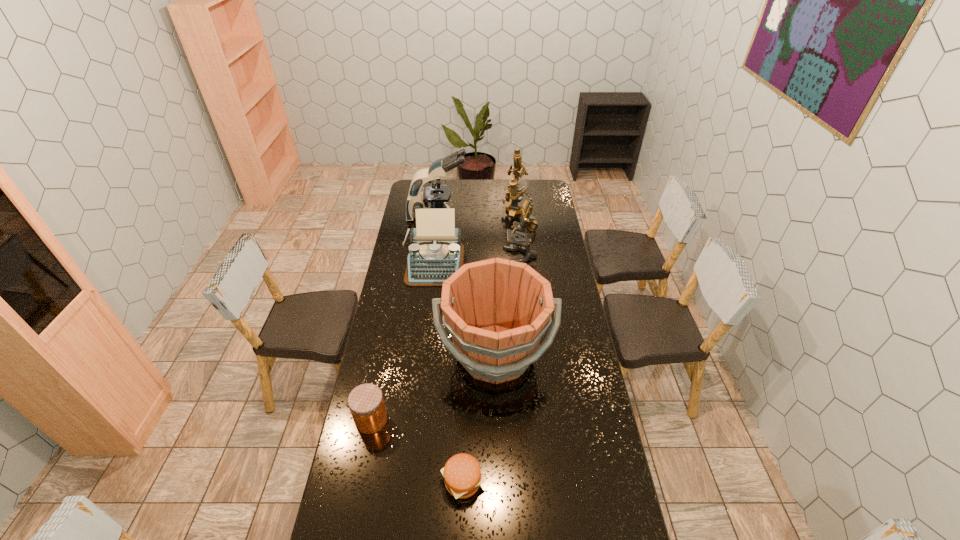
You are a GUI agent. You are given a task and a screenshot of the screen. Output one action in this format:
    pyautogui.click(x=<x>, y=<y>)
    Task: Click on the vacant area situated at the eyepieces of the nearest microscope
    This screenshot has height=540, width=960.
    Given the screenshot: What is the action you would take?
    pyautogui.click(x=449, y=256)

Identify the location of free space located 0.400m at the eyepieces of the nearest microscope. (426, 256).

What are the coordinates of `vacant point located at the eyepieces of the nearest microscope` in the screenshot? It's located at pyautogui.click(x=478, y=256).

This screenshot has width=960, height=540. Identify the location of vacant space located 0.200m on the typing side of the fifth tallest object. (428, 317).

Image resolution: width=960 pixels, height=540 pixels. In order to click on free region located 0.100m on the right of the sixth tallest object in this screenshot , I will do `click(416, 420)`.

Locate an element on the screen. This screenshot has height=540, width=960. free space located on the back of the nearest object is located at coordinates pyautogui.click(x=466, y=391).

Where is `microscope that is at the left edge`? microscope that is at the left edge is located at coordinates (434, 196).

Find the location of `typewriter that is at the left edge`. typewriter that is at the left edge is located at coordinates (435, 252).

Identify the location of jar present at the left edge. This screenshot has height=540, width=960. [366, 403].

Find the location of a particular element. bucket positioned at the right edge is located at coordinates (496, 310).